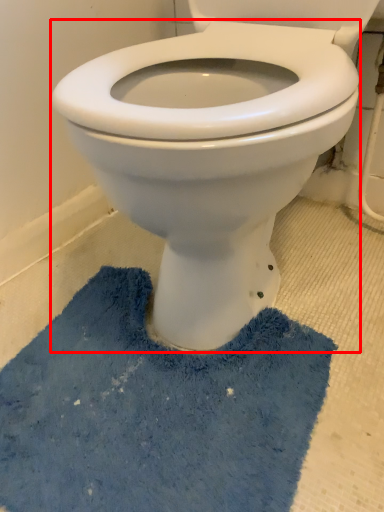
Question: From the image's perspective, what is the correct spatial positioning of bidet (annotated by the red box) in reference to bath mat?

Choices:
 (A) above
 (B) below

Answer: (A)